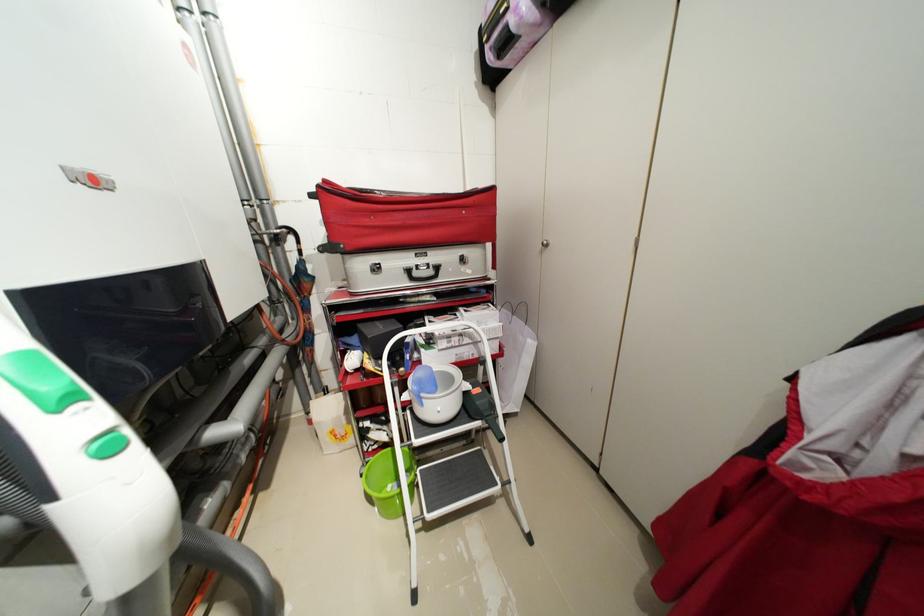
Locate an element on the screen. This screenshot has height=616, width=924. black suitcase handle is located at coordinates (404, 217).